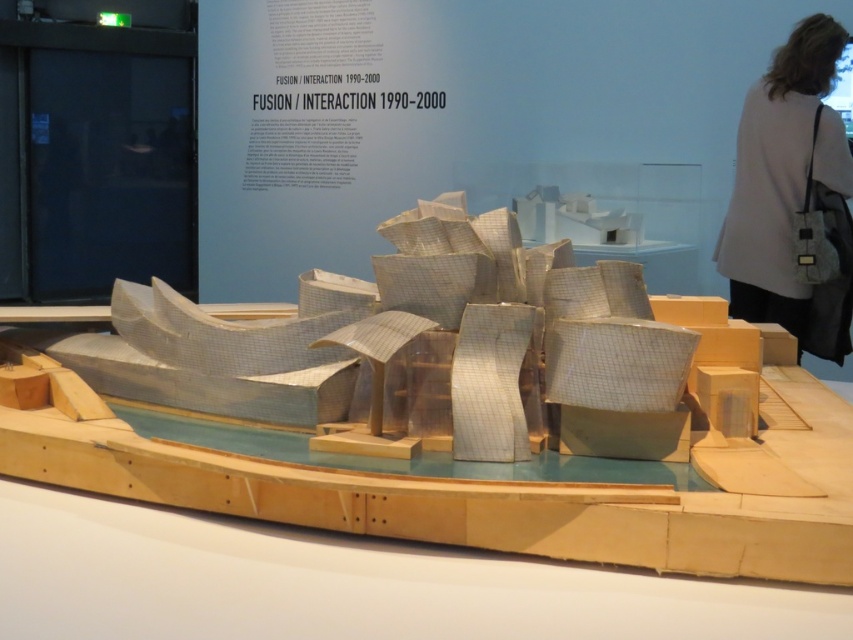
Does metallic grid boat at center have a smaller size compared to white fabric bag at upper right?

Incorrect, metallic grid boat at center is not smaller in size than white fabric bag at upper right.

Which is more to the right, metallic grid boat at center or white fabric bag at upper right?

From the viewer's perspective, white fabric bag at upper right appears more on the right side.

Which is in front, point (457, 516) or point (846, 333)?

Positioned in front is point (457, 516).

You are a GUI agent. You are given a task and a screenshot of the screen. Output one action in this format:
    pyautogui.click(x=<x>, y=<y>)
    Task: Click on the metallic grid boat at center
    This screenshot has height=640, width=853.
    Given the screenshot: What is the action you would take?
    pyautogui.click(x=451, y=438)